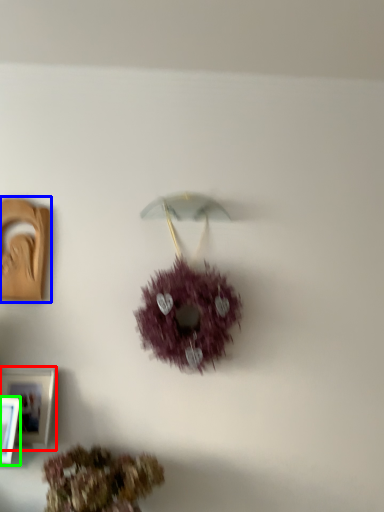
Question: Estimate the real-world distances between objects in this image. Which object is farther from picture frame (highlighted by a red box), picture frame (highlighted by a blue box) or picture frame (highlighted by a green box)?

Choices:
 (A) picture frame
 (B) picture frame

Answer: (A)